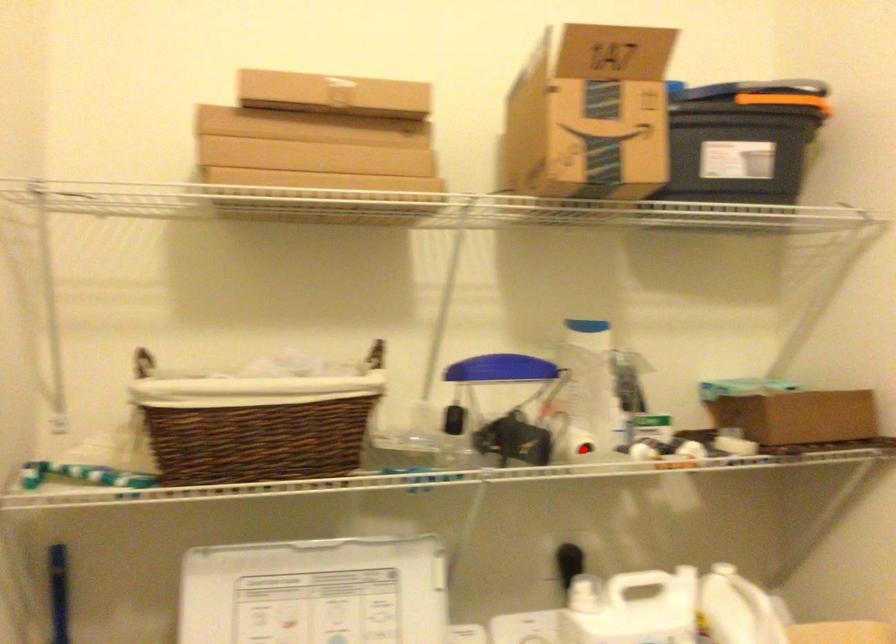
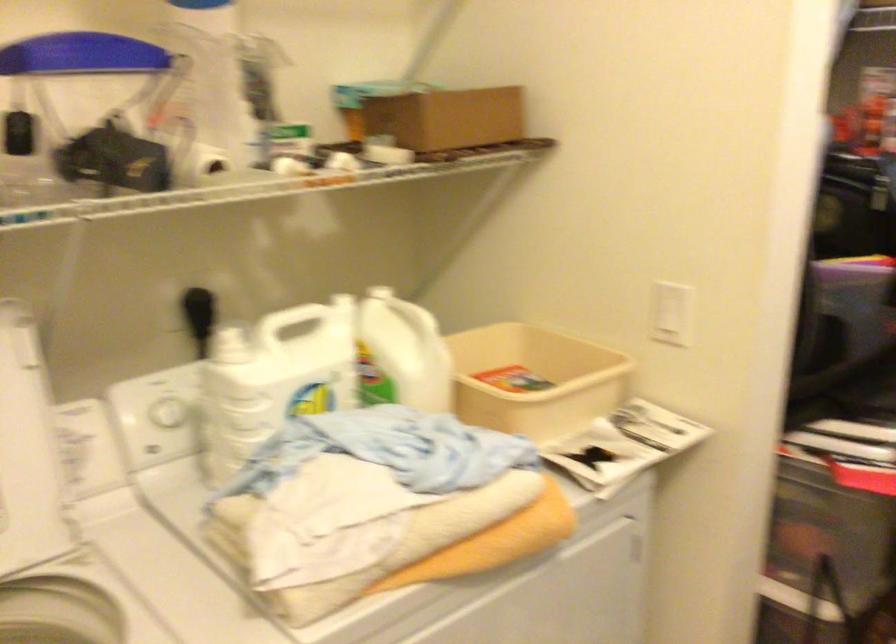
Question: I am providing you with two images of the same scene from different viewpoints. A red point is marked on the first image. Can you still see the location of the red point in image 2?

Choices:
 (A) Yes
 (B) No

Answer: (A)